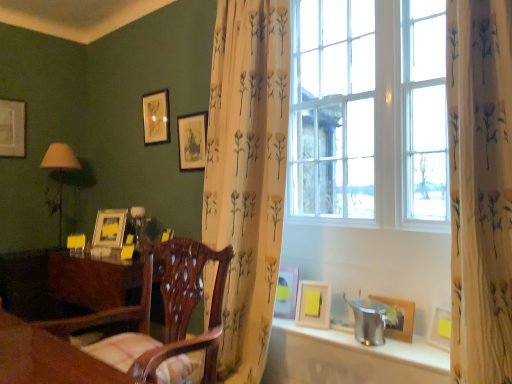
Image resolution: width=512 pixels, height=384 pixels. I want to click on free space in front of matte white picture frame at center, the 5th picture frame viewed from the left, so click(283, 319).